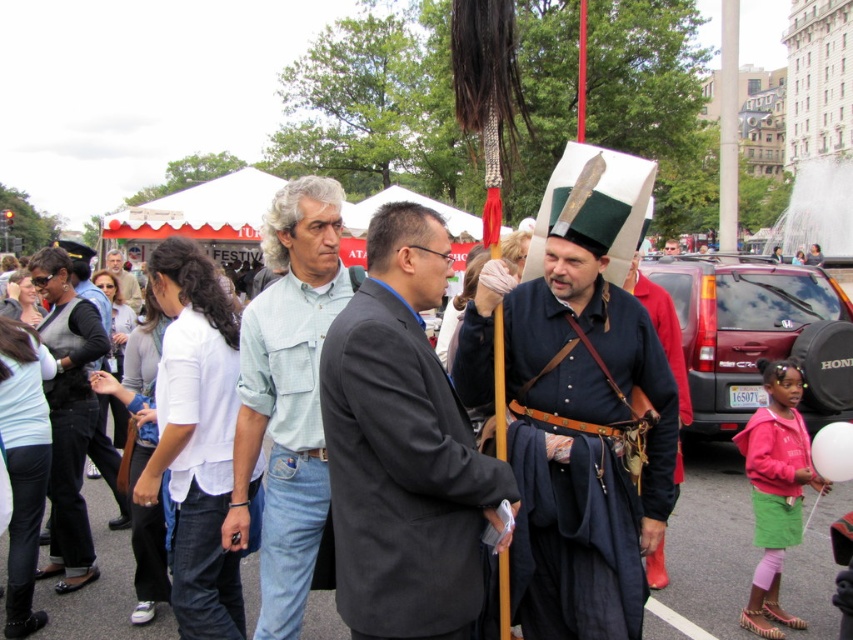
Question: Which point appears farthest from the camera in this image?

Choices:
 (A) (74, 362)
 (B) (154, 387)
 (C) (259, 625)
 (D) (137, 307)

Answer: (D)

Question: Does white cotton shirt at center have a lesser width compared to light blue denim shirt at center?

Choices:
 (A) yes
 (B) no

Answer: (B)

Question: Considering the real-world distances, which object is farthest from the black leather jacket at center?

Choices:
 (A) matte black hat at center
 (B) white cotton shirt at center
 (C) dark gray suit at center
 (D) green checkered shirt at center

Answer: (A)

Question: Is dark gray suit at center further to camera compared to matte black hat at center?

Choices:
 (A) yes
 (B) no

Answer: (B)

Question: Does dark blue linen coat at center appear on the left side of matte black hat at center?

Choices:
 (A) yes
 (B) no

Answer: (A)

Question: Which of the following is the farthest from the observer?

Choices:
 (A) (59, 294)
 (B) (277, 502)
 (C) (177, 600)
 (D) (129, 285)

Answer: (D)